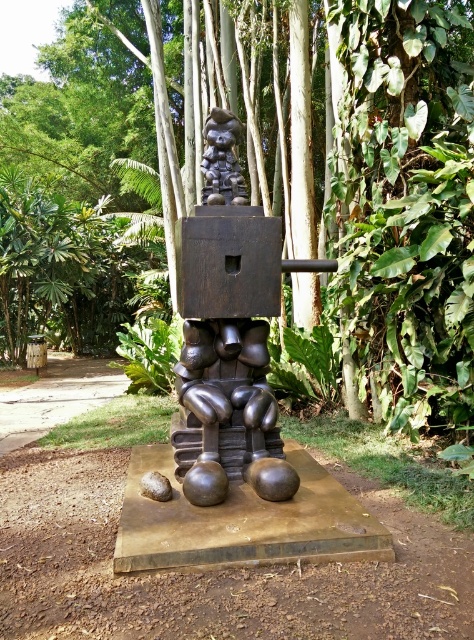
Which is above, black matte skull at upper center or brown smooth rock at center?

black matte skull at upper center is above.

Is point (218, 128) closer to camera compared to point (167, 497)?

That is False.

This screenshot has height=640, width=474. In order to click on black matte skull at upper center in this screenshot , I will do `click(222, 160)`.

Does green leafy tree at center appear on the left side of brown smooth rock at center?

Correct, you'll find green leafy tree at center to the left of brown smooth rock at center.

Is green leafy tree at center wider than brown smooth rock at center?

Indeed, green leafy tree at center has a greater width compared to brown smooth rock at center.

Is point (456, 387) farther from camera compared to point (140, 492)?

Yes, it is behind point (140, 492).

The height and width of the screenshot is (640, 474). Identify the location of green leafy tree at center. (261, 179).

Is green leafy tree at center above black matte skull at upper center?

Yes.

Is green leafy tree at center behind black matte skull at upper center?

No.

Does point (388, 330) come in front of point (216, 202)?

No, (388, 330) is behind (216, 202).

Image resolution: width=474 pixels, height=640 pixels. In order to click on green leafy tree at center in this screenshot , I will do `click(261, 179)`.